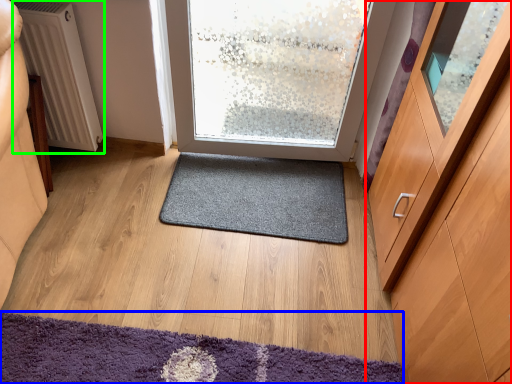
Question: Estimate the real-world distances between objects in this image. Which object is closer to cabinetry (highlighted by a red box), mat (highlighted by a blue box) or radiator (highlighted by a green box)?

Choices:
 (A) mat
 (B) radiator

Answer: (A)